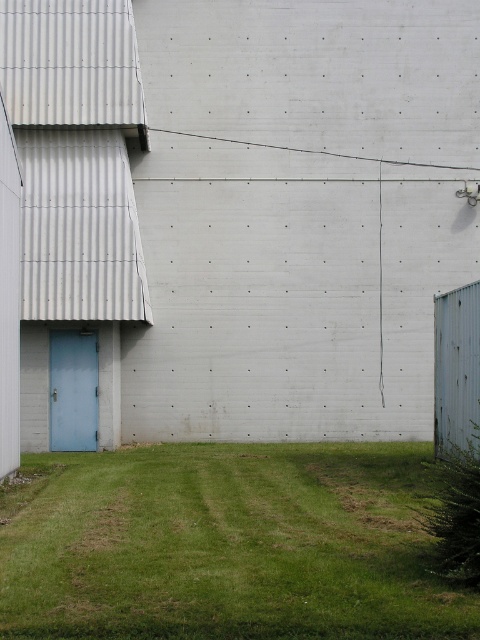
Question: Which of the following is the farthest from the observer?

Choices:
 (A) 50,397
 (B) 275,468
 (C) 34,339

Answer: (A)

Question: Does light blue painted wood door at left appear on the right side of blue matte door at left?

Choices:
 (A) no
 (B) yes

Answer: (B)

Question: Is green grass at lower center in front of light blue painted wood door at left?

Choices:
 (A) yes
 (B) no

Answer: (A)

Question: Where is light blue painted wood door at left located in relation to blue matte door at left in the image?

Choices:
 (A) right
 (B) left

Answer: (A)

Question: Which object is closer to the camera taking this photo?

Choices:
 (A) blue matte door at left
 (B) green grass at lower center
 (C) light blue painted wood door at left

Answer: (B)

Question: Which point is closer to the camera taking this photo?

Choices:
 (A) (50, 340)
 (B) (395, 547)

Answer: (B)